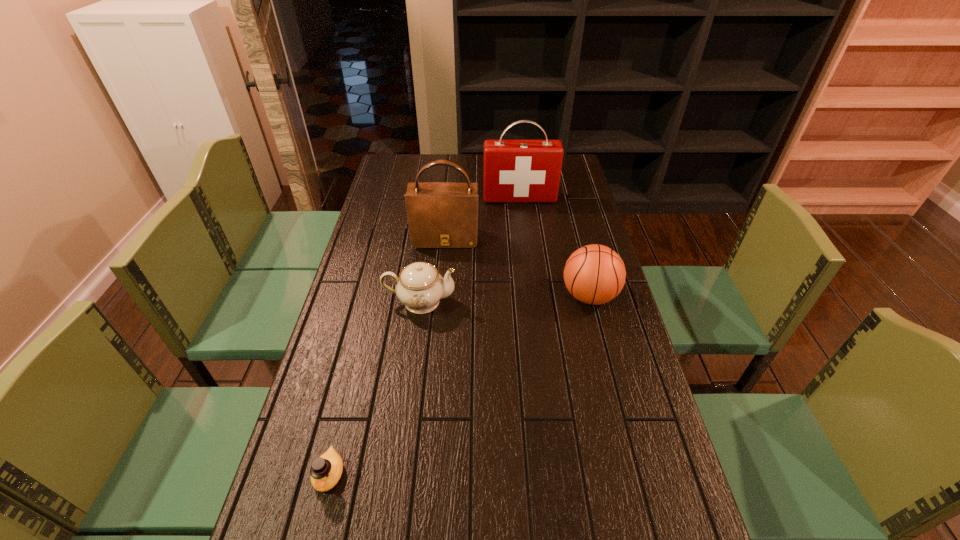
Image resolution: width=960 pixels, height=540 pixels. What are the coordinates of `vacant area between the chinaware and the third tallest object` in the screenshot? It's located at (505, 299).

I want to click on vacant area between the nearest object and the third tallest object, so click(459, 385).

Find the location of `free point between the nearest object and the fourth nearest object`. free point between the nearest object and the fourth nearest object is located at coordinates (387, 356).

Where is `empty space that is in between the basketball and the chinaware`? empty space that is in between the basketball and the chinaware is located at coordinates (505, 299).

Identify the location of vacant area that lies between the chinaware and the first-aid kit. Image resolution: width=960 pixels, height=540 pixels. point(470,250).

Find the location of a particular element. The height and width of the screenshot is (540, 960). vacant space that is in between the first-aid kit and the fourth tallest object is located at coordinates (470, 250).

Image resolution: width=960 pixels, height=540 pixels. What are the coordinates of `empty space that is in between the farthest object and the chinaware` in the screenshot? It's located at (470, 250).

Select which object is the fourth closest to the shortest object. Please provide its 2D coordinates. Your answer should be formatted as a tuple, i.e. [(x, y)], where the tuple contains the x and y coordinates of a point satisfying the conditions above.

[(515, 171)]

At what (x,y) coordinates should I click in order to perform the action: click on the closest object to the shortest object. Please return your answer as a coordinate pair (x, y). The height and width of the screenshot is (540, 960). Looking at the image, I should click on (420, 286).

The width and height of the screenshot is (960, 540). In order to click on blank area in the image that satisfies the following two spatial constraints: 1. on the front flap of the fourth nearest object; 2. at the spout of the fourth tallest object in this screenshot , I will do `click(440, 301)`.